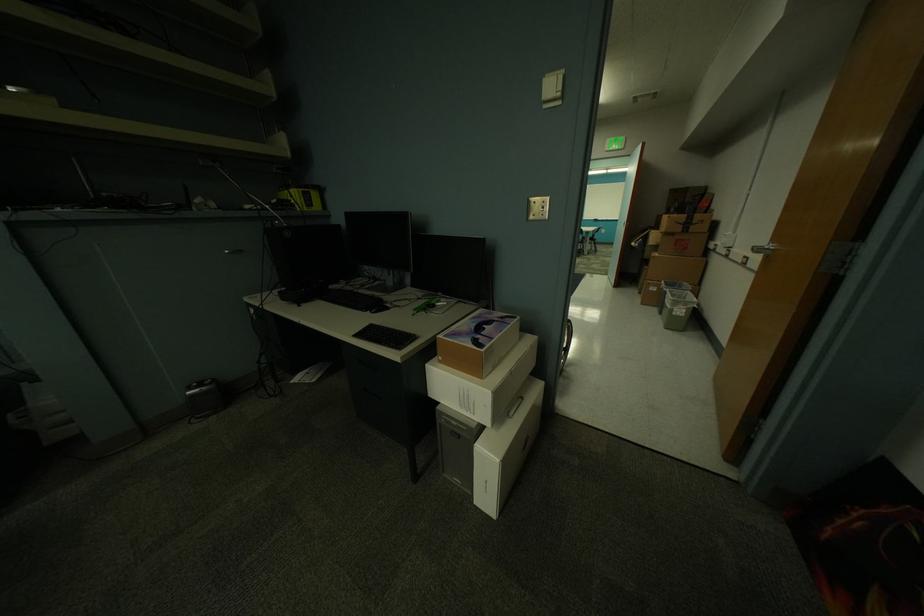
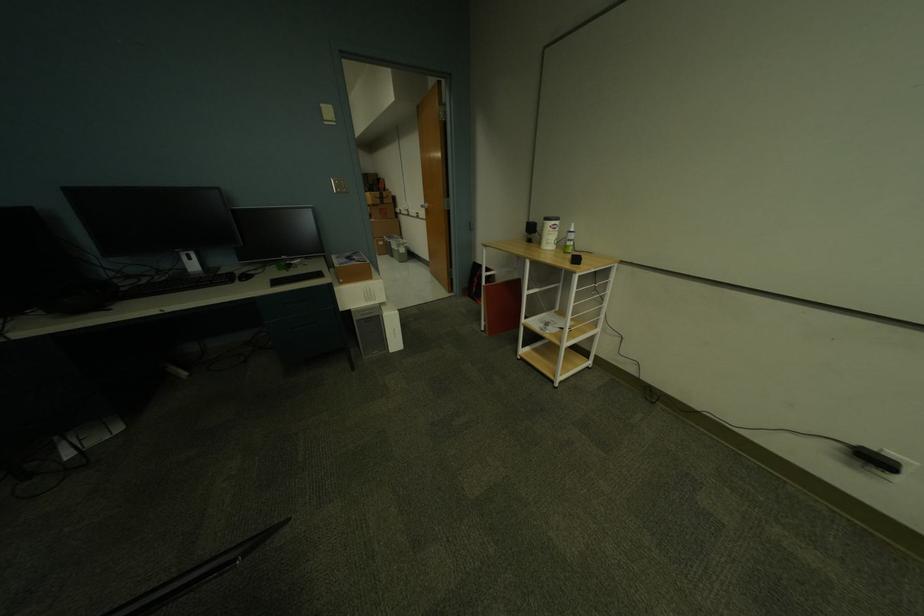
Find the pixel in the second image that matches pixel 675 294 in the first image.

(398, 244)